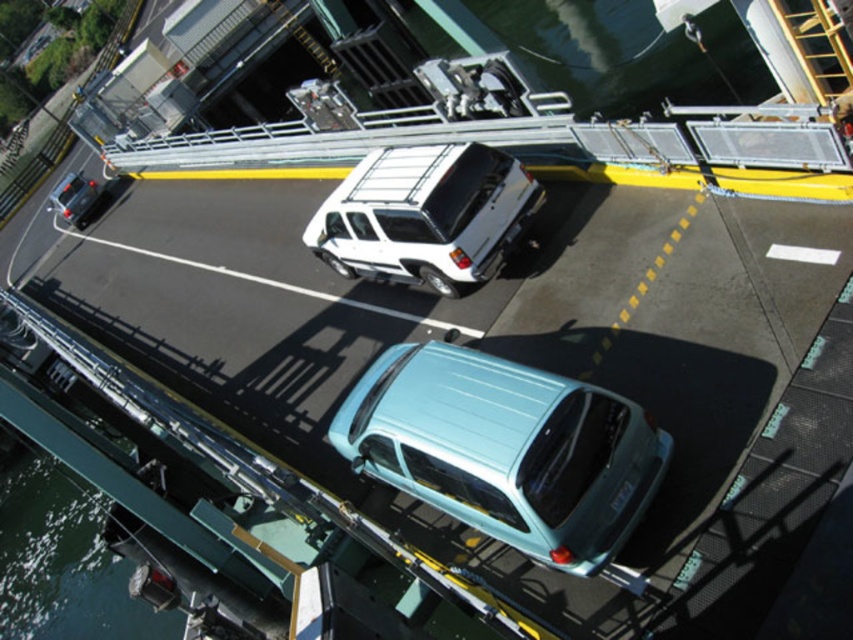
Question: Which of the following is the closest to the observer?

Choices:
 (A) white matte truck at center
 (B) light blue matte hatchback at center
 (C) matte black car at left

Answer: (B)

Question: Is light blue matte hatchback at center positioned before white matte truck at center?

Choices:
 (A) yes
 (B) no

Answer: (A)

Question: Among these objects, which one is farthest from the camera?

Choices:
 (A) white matte truck at center
 (B) matte black car at left

Answer: (B)

Question: Which point is closer to the camera?

Choices:
 (A) (78, 186)
 (B) (463, 406)

Answer: (B)

Question: Does light blue matte hatchback at center appear under white matte truck at center?

Choices:
 (A) no
 (B) yes

Answer: (B)

Question: Can you confirm if light blue matte hatchback at center is positioned to the right of matte black car at left?

Choices:
 (A) yes
 (B) no

Answer: (A)